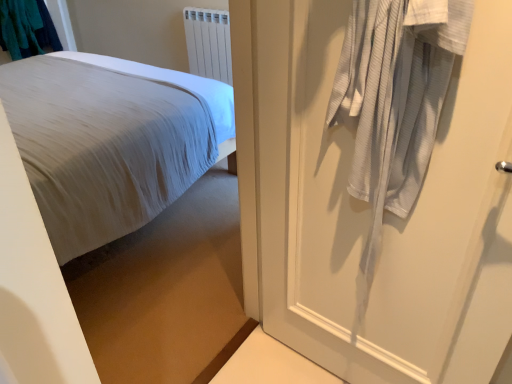
Describe the element at coordinates (110, 141) in the screenshot. I see `white cotton bed at left` at that location.

Find the location of a particular element. white cotton bed at left is located at coordinates (110, 141).

Describe the element at coordinates (26, 28) in the screenshot. I see `teal fabric laundry at upper left` at that location.

Where is `white textured door at right`? white textured door at right is located at coordinates (369, 206).

What do you see at coordinates (369, 206) in the screenshot? I see `white textured door at right` at bounding box center [369, 206].

Where is `white plastic radiator at upper center`? This screenshot has height=384, width=512. white plastic radiator at upper center is located at coordinates (208, 43).

Locate an element on the screen. white cotton bed at left is located at coordinates (110, 141).

Considering the relative sizes of teal fabric laundry at upper left and white textured door at right in the image provided, is teal fabric laundry at upper left bigger than white textured door at right?

No, teal fabric laundry at upper left is not bigger than white textured door at right.

Looking at this image, looking at their sizes, would you say teal fabric laundry at upper left is wider or thinner than white textured door at right?

Clearly, teal fabric laundry at upper left has more width compared to white textured door at right.

This screenshot has width=512, height=384. Find the location of `laundry located behind the white textured door at right`. laundry located behind the white textured door at right is located at coordinates (26, 28).

In the scene shown: From the image's perspective, which is below, teal fabric laundry at upper left or white textured door at right?

white textured door at right, from the image's perspective.

Considering the relative sizes of teal fabric laundry at upper left and white cotton bed at left in the image provided, is teal fabric laundry at upper left thinner than white cotton bed at left?

Correct, the width of teal fabric laundry at upper left is less than that of white cotton bed at left.

Is teal fabric laundry at upper left placed right next to white cotton bed at left?

No, teal fabric laundry at upper left is not next to white cotton bed at left.

Considering the relative sizes of teal fabric laundry at upper left and white cotton bed at left in the image provided, is teal fabric laundry at upper left shorter than white cotton bed at left?

Yes, teal fabric laundry at upper left is shorter than white cotton bed at left.

Does teal fabric laundry at upper left turn towards white cotton bed at left?

Yes, teal fabric laundry at upper left is oriented towards white cotton bed at left.

Is white cotton bed at left facing towards white textured door at right?

No, white cotton bed at left is not turned towards white textured door at right.

Is white cotton bed at left at the left side of white textured door at right?

Yes, white cotton bed at left is to the left of white textured door at right.

From a real-world perspective, is white cotton bed at left physically below white textured door at right?

Yes, from a real-world perspective, white cotton bed at left is beneath white textured door at right.

From the image's perspective, is white plastic radiator at upper center below teal fabric laundry at upper left?

Indeed, from the image's perspective, white plastic radiator at upper center is shown beneath teal fabric laundry at upper left.

Considering the relative positions of white plastic radiator at upper center and teal fabric laundry at upper left in the image provided, is white plastic radiator at upper center to the left or to the right of teal fabric laundry at upper left?

white plastic radiator at upper center is positioned on teal fabric laundry at upper left's right side.

In the scene shown: From their relative heights in the image, would you say white plastic radiator at upper center is taller or shorter than teal fabric laundry at upper left?

Considering their sizes, white plastic radiator at upper center has more height than teal fabric laundry at upper left.

Is white textured door at right at the left side of white cotton bed at left?

No, white textured door at right is not to the left of white cotton bed at left.

In the scene shown: Is white textured door at right inside the boundaries of white cotton bed at left, or outside?

white textured door at right is spatially situated outside white cotton bed at left.

From the image's perspective, would you say white textured door at right is shown under white cotton bed at left?

Yes.

Which of these two, white textured door at right or white cotton bed at left, is smaller?

With smaller size is white textured door at right.

Can you confirm if white plastic radiator at upper center is positioned to the right of white textured door at right?

No.

Considering the sizes of objects white plastic radiator at upper center and white textured door at right in the image provided, who is wider, white plastic radiator at upper center or white textured door at right?

white plastic radiator at upper center.

Are white plastic radiator at upper center and white textured door at right beside each other?

No, white plastic radiator at upper center is not next to white textured door at right.

Which point is more forward, (221, 19) or (449, 185)?

Positioned in front is point (449, 185).

Are white cotton bed at left and white plastic radiator at upper center far apart?

Yes.

From a real-world perspective, which object stands above the other?

white plastic radiator at upper center, from a real-world perspective.

Between white cotton bed at left and white plastic radiator at upper center, which one appears on the right side from the viewer's perspective?

white plastic radiator at upper center.

Which is in front, white cotton bed at left or white plastic radiator at upper center?

Positioned in front is white cotton bed at left.

Where is `laundry lying on the left of white textured door at right`? The width and height of the screenshot is (512, 384). laundry lying on the left of white textured door at right is located at coordinates (26, 28).

Where is `laundry behind the white cotton bed at left`? The image size is (512, 384). laundry behind the white cotton bed at left is located at coordinates (26, 28).

Considering their positions, is white textured door at right positioned further to white cotton bed at left than teal fabric laundry at upper left?

teal fabric laundry at upper left is further to white cotton bed at left.

From the picture: From the image, which object appears to be farther from white plastic radiator at upper center, white cotton bed at left or teal fabric laundry at upper left?

Based on the image, teal fabric laundry at upper left appears to be further to white plastic radiator at upper center.

When comparing their distances from white plastic radiator at upper center, does teal fabric laundry at upper left or white cotton bed at left seem further?

teal fabric laundry at upper left is positioned further to the anchor white plastic radiator at upper center.

From the image, which object appears to be farther from white cotton bed at left, teal fabric laundry at upper left or white textured door at right?

teal fabric laundry at upper left.

Considering their positions, is white textured door at right positioned further to white cotton bed at left than white plastic radiator at upper center?

white plastic radiator at upper center lies further to white cotton bed at left than the other object.

Based on their spatial positions, is white cotton bed at left or white textured door at right further from teal fabric laundry at upper left?

white textured door at right lies further to teal fabric laundry at upper left than the other object.

Which object lies further to the anchor point white plastic radiator at upper center, white cotton bed at left or white textured door at right?

white textured door at right is further to white plastic radiator at upper center.

Looking at the image, which one is located closer to white textured door at right, white cotton bed at left or white plastic radiator at upper center?

Among the two, white cotton bed at left is located nearer to white textured door at right.

Identify the location of bed located between white textured door at right and white plastic radiator at upper center in the depth direction. (110, 141).

Locate an element on the screen. bed positioned between white textured door at right and teal fabric laundry at upper left from near to far is located at coordinates (110, 141).

Identify the location of radiator between white textured door at right and teal fabric laundry at upper left in the front-back direction. The image size is (512, 384). (208, 43).

The height and width of the screenshot is (384, 512). In order to click on radiator located between white cotton bed at left and teal fabric laundry at upper left in the depth direction in this screenshot , I will do `click(208, 43)`.